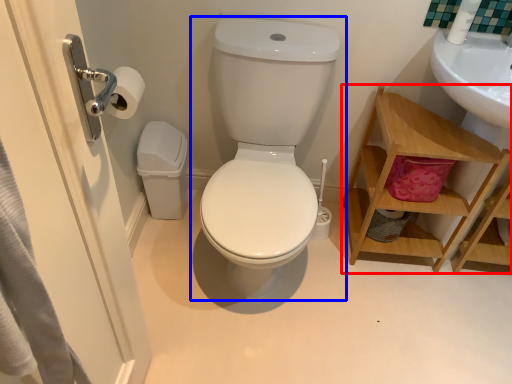
Question: Which point is closer to the camera, shelf (highlighted by a red box) or toilet (highlighted by a blue box)?

Choices:
 (A) shelf
 (B) toilet

Answer: (B)